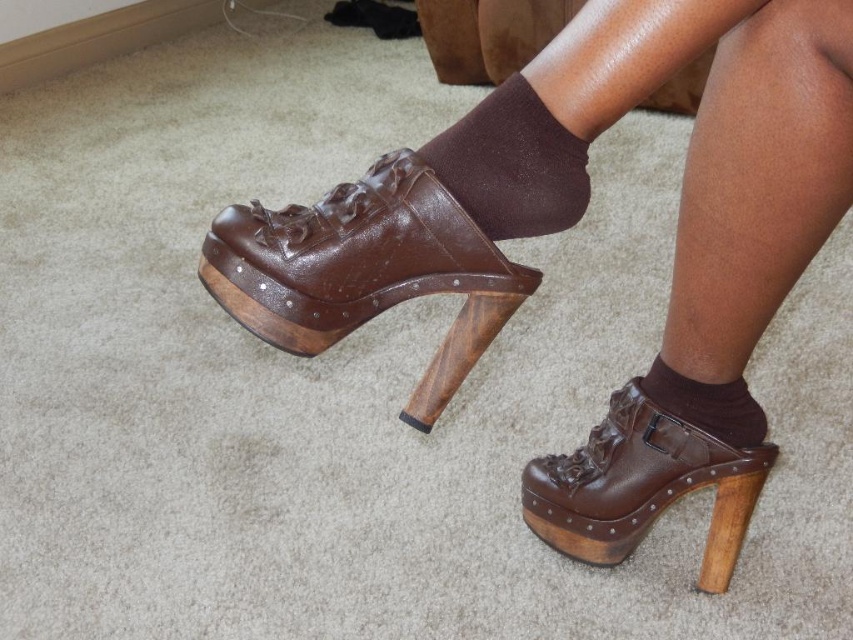
Question: In this image, where is brown leather clogs at center located relative to brown leather platform shoe at center?

Choices:
 (A) right
 (B) left

Answer: (B)

Question: Among these objects, which one is nearest to the camera?

Choices:
 (A) brown leather clog at center
 (B) brown leather clogs at center

Answer: (B)

Question: Which point is farther from the camera taking this photo?

Choices:
 (A) (688, 449)
 (B) (840, 113)

Answer: (A)

Question: Which of the following is the closest to the observer?

Choices:
 (A) (416, 202)
 (B) (618, 490)
 (C) (648, 444)
 (D) (666, 394)

Answer: (A)

Question: Where is brown leather clogs at center located in relation to brown smooth sock at lower center in the image?

Choices:
 (A) right
 (B) left

Answer: (B)

Question: Does brown leather clog at center have a larger size compared to brown leather platform shoe at center?

Choices:
 (A) no
 (B) yes

Answer: (B)